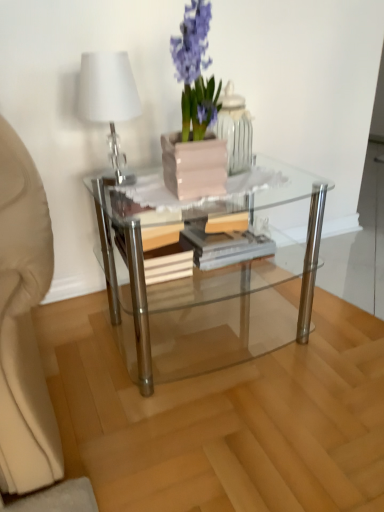
Question: Could white glossy table lamp at upper left be considered to be inside pink glossy vase at upper center?

Choices:
 (A) yes
 (B) no

Answer: (B)

Question: Is pink glossy vase at upper center oriented away from white glossy table lamp at upper left?

Choices:
 (A) yes
 (B) no

Answer: (B)

Question: Considering the relative sizes of pink glossy vase at upper center and white glossy table lamp at upper left in the image provided, is pink glossy vase at upper center wider than white glossy table lamp at upper left?

Choices:
 (A) yes
 (B) no

Answer: (B)

Question: From the image's perspective, would you say pink glossy vase at upper center is positioned over white glossy table lamp at upper left?

Choices:
 (A) yes
 (B) no

Answer: (A)

Question: Is pink glossy vase at upper center closer to camera compared to white glossy table lamp at upper left?

Choices:
 (A) no
 (B) yes

Answer: (A)

Question: Is point (231, 94) positioned closer to the camera than point (119, 94)?

Choices:
 (A) closer
 (B) farther

Answer: (B)

Question: From a real-world perspective, is pink glossy vase at upper center above or below white glossy table lamp at upper left?

Choices:
 (A) below
 (B) above

Answer: (A)

Question: From the image's perspective, is pink glossy vase at upper center located above or below white glossy table lamp at upper left?

Choices:
 (A) above
 (B) below

Answer: (A)

Question: Visually, is pink glossy vase at upper center positioned to the left or to the right of white glossy table lamp at upper left?

Choices:
 (A) right
 (B) left

Answer: (A)

Question: Considering the relative positions of transparent glass coffee table at center and pink glossy vase at upper center in the image provided, is transparent glass coffee table at center to the left or to the right of pink glossy vase at upper center?

Choices:
 (A) left
 (B) right

Answer: (A)

Question: In terms of height, does transparent glass coffee table at center look taller or shorter compared to pink glossy vase at upper center?

Choices:
 (A) short
 (B) tall

Answer: (B)

Question: Do you think transparent glass coffee table at center is within pink glossy vase at upper center, or outside of it?

Choices:
 (A) outside
 (B) inside

Answer: (A)

Question: Is transparent glass coffee table at center in front of or behind pink glossy vase at upper center in the image?

Choices:
 (A) front
 (B) behind

Answer: (A)

Question: Is point tap(230, 152) positioned closer to the camera than point tap(294, 253)?

Choices:
 (A) farther
 (B) closer

Answer: (B)

Question: Considering their positions, is pink glossy vase at upper center located in front of or behind transparent glass coffee table at center?

Choices:
 (A) front
 (B) behind

Answer: (B)